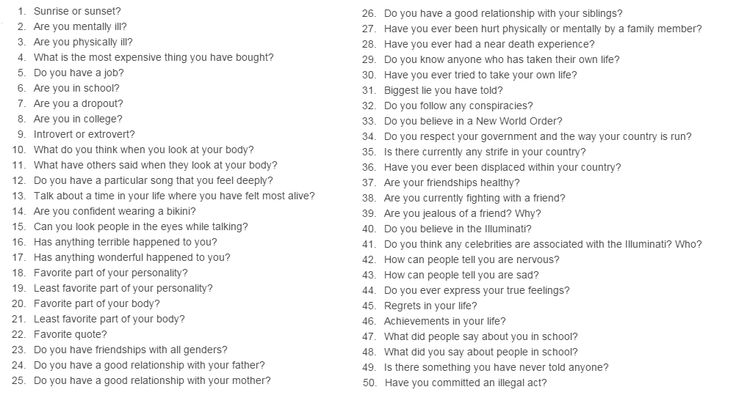
Where is `left column`? left column is located at coordinates (135, 79).